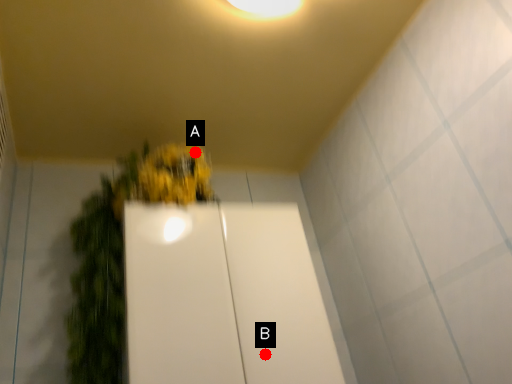
Question: Two points are circled on the image, labeled by A and B beside each circle. Which point is closer to the camera?

Choices:
 (A) A is closer
 (B) B is closer

Answer: (B)